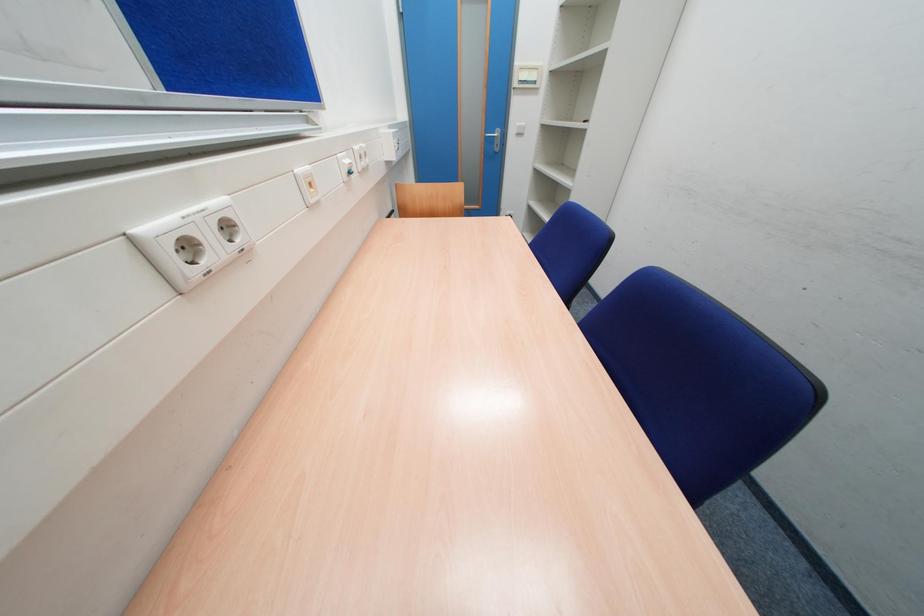
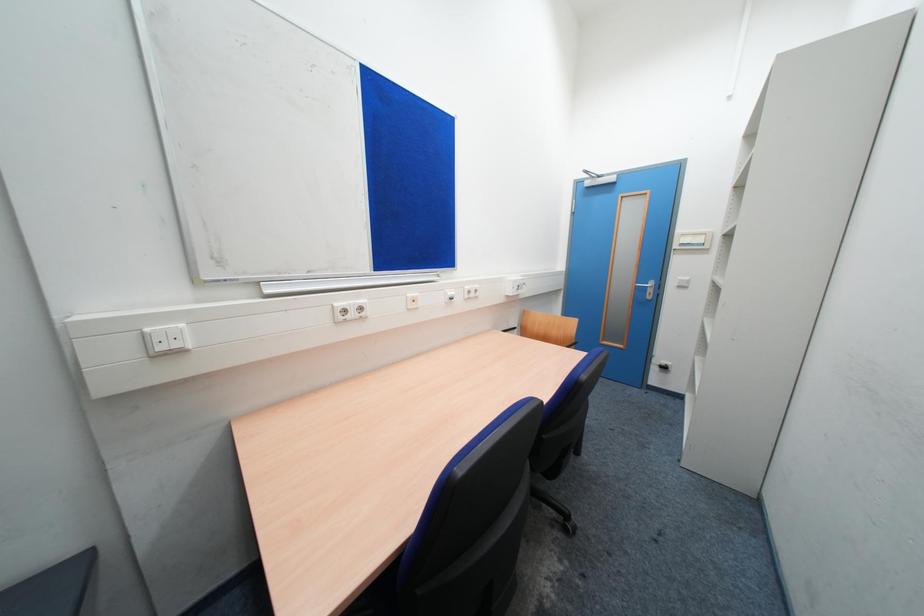
Based on the continuous images, in which direction is the camera rotating?

The rotation direction of the camera is left-up.